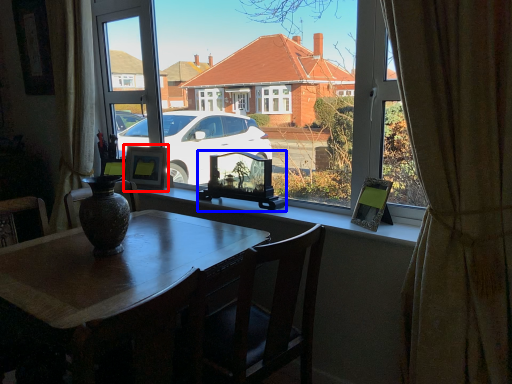
Question: Which object is further to the camera taking this photo, picture frame (highlighted by a red box) or picture frame (highlighted by a blue box)?

Choices:
 (A) picture frame
 (B) picture frame

Answer: (A)